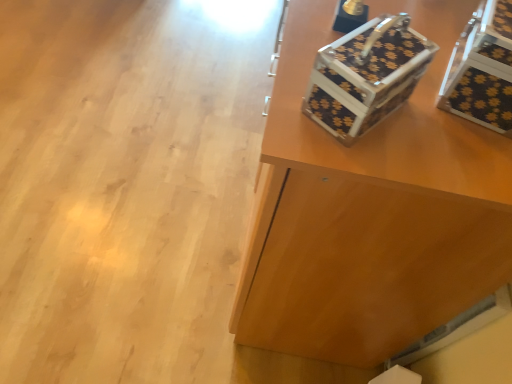
This screenshot has height=384, width=512. I want to click on vacant space that is to the left of black textured suitcase at upper right, so click(x=148, y=117).